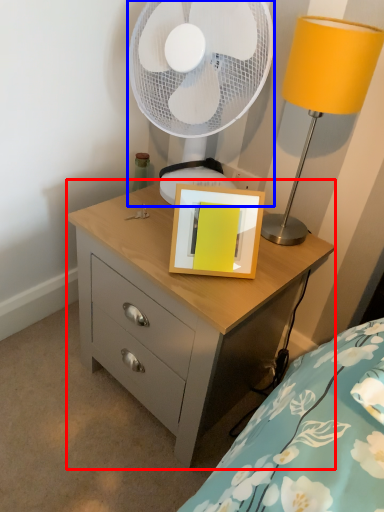
Question: Which of the following is the farthest to the observer, chest of drawers (highlighted by a red box) or mechanical fan (highlighted by a blue box)?

Choices:
 (A) chest of drawers
 (B) mechanical fan

Answer: (B)